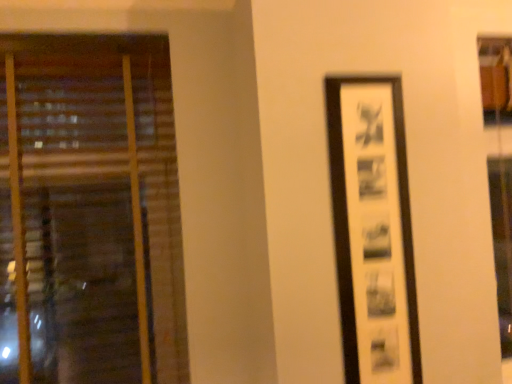
Question: Considering the positions of black matte picture frame at right and wooden blinds at left in the image, is black matte picture frame at right wider or thinner than wooden blinds at left?

Choices:
 (A) wide
 (B) thin

Answer: (B)

Question: Considering the relative positions of black matte picture frame at right and wooden blinds at left in the image provided, is black matte picture frame at right to the left or to the right of wooden blinds at left?

Choices:
 (A) left
 (B) right

Answer: (B)

Question: In terms of size, does black matte picture frame at right appear bigger or smaller than wooden blinds at left?

Choices:
 (A) small
 (B) big

Answer: (A)

Question: In terms of size, does wooden blinds at left appear bigger or smaller than black matte picture frame at right?

Choices:
 (A) small
 (B) big

Answer: (B)

Question: Considering their positions, is wooden blinds at left located in front of or behind black matte picture frame at right?

Choices:
 (A) behind
 (B) front

Answer: (A)

Question: From a real-world perspective, is wooden blinds at left positioned above or below black matte picture frame at right?

Choices:
 (A) above
 (B) below

Answer: (A)

Question: Is wooden blinds at left wider or thinner than black matte picture frame at right?

Choices:
 (A) wide
 (B) thin

Answer: (A)